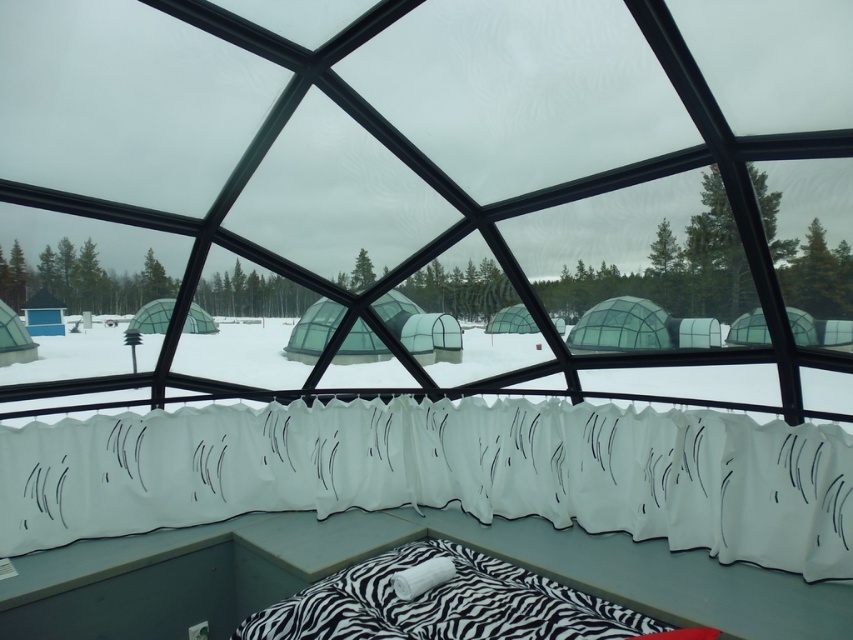
Question: Among these objects, which one is nearest to the camera?

Choices:
 (A) transparent glass window at center
 (B) zebra-patterned fabric bed at center
 (C) white sheer curtain at lower center
 (D) matte black dome at left

Answer: (A)

Question: From the image, what is the correct spatial relationship of white sheer curtain at lower center in relation to transparent plastic dome at center?

Choices:
 (A) left
 (B) right

Answer: (B)

Question: In this image, where is transparent plastic dome at center located relative to matte black dome at left?

Choices:
 (A) below
 (B) above

Answer: (A)

Question: Among these objects, which one is nearest to the camera?

Choices:
 (A) matte black dome at left
 (B) zebra-patterned fabric bed at center
 (C) white soft pillow at lower center
 (D) transparent plastic dome at center

Answer: (B)

Question: Which object appears farthest from the camera in this image?

Choices:
 (A) transparent glass window at center
 (B) white sheer curtain at lower center
 (C) matte black dome at left

Answer: (C)

Question: Can you confirm if zebra-patterned fabric bed at center is bigger than matte black dome at left?

Choices:
 (A) yes
 (B) no

Answer: (A)